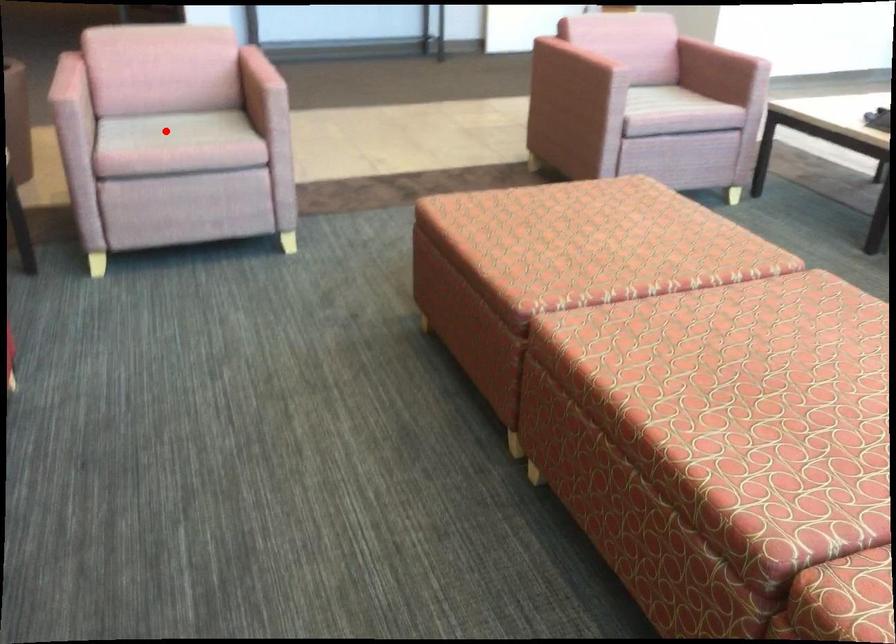
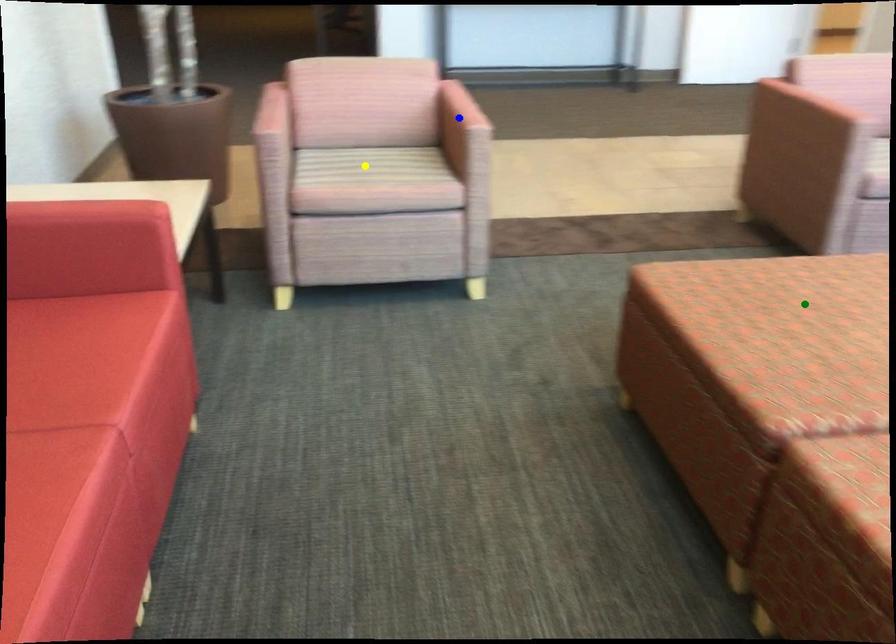
Question: I am providing you with two images of the same scene from different viewpoints. A red point is marked on the first image. You are given multiple points on the second image. Which spot in image 2 lines up with the point in image 1?

Choices:
 (A) green point
 (B) blue point
 (C) yellow point

Answer: (C)